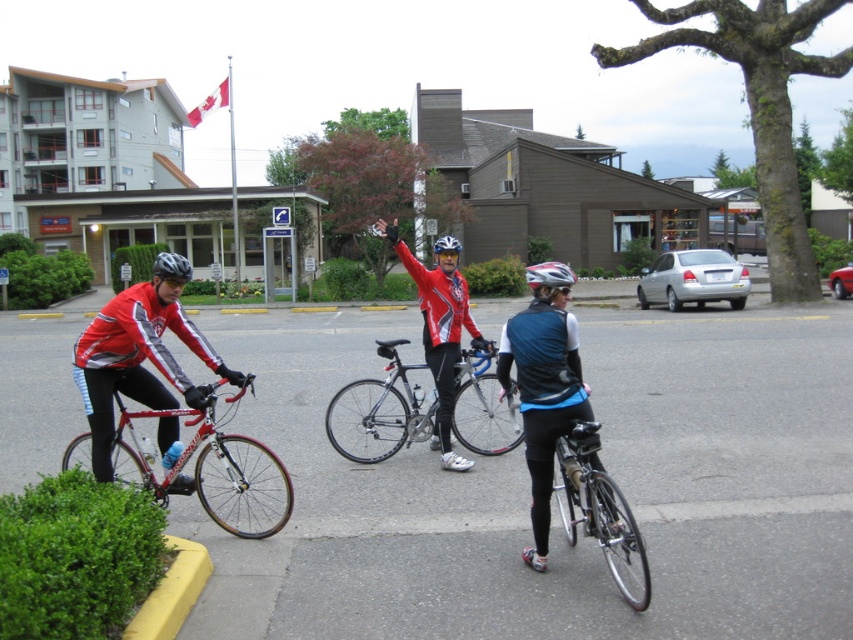
You are a photographer trying to capture the cyclists. You notice the shiny red jacket at center and the shiny silver helmet at center. Which object would require a wider lens to fully capture in the photo?

The shiny silver helmet at center requires a wider lens because its width is greater than the shiny red jacket at center.

You are a photographer positioned at the back of the cyclists. You want to capture a photo where the shiny silver bicycle at center and the matte black helmet at center are both clearly visible. Based on their positions, which object should appear lower in the photo?

The shiny silver bicycle at center should appear lower in the photo because it is positioned below the matte black helmet at center.

You are a photographer positioned at the back of the cyclists. You need to capture a photo where both the shiny black bicycle at center and the shiny red helmet at center are clearly visible. Considering their widths, which object will occupy more space in the photo?

The shiny black bicycle at center will occupy more space in the photo because its width surpasses that of the shiny red helmet at center, as stated in the description.